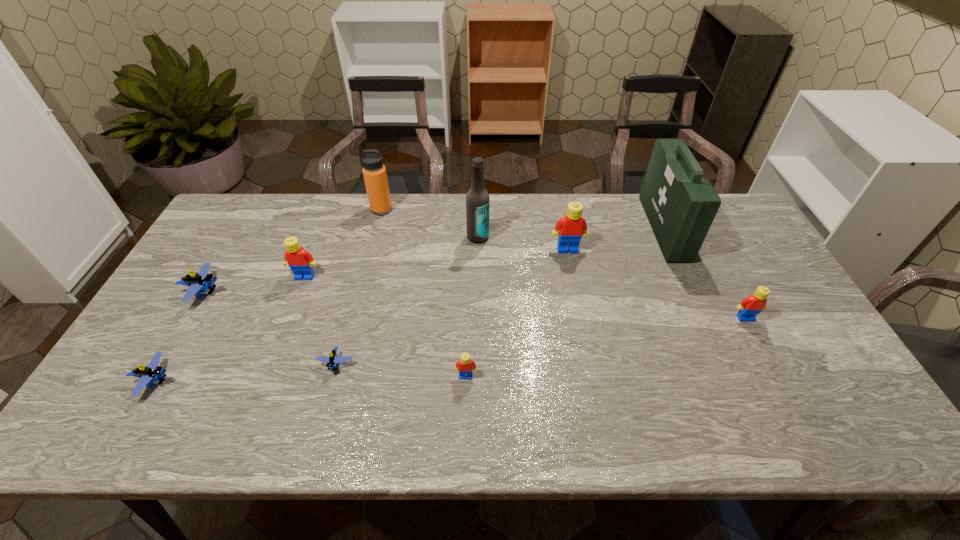
This screenshot has width=960, height=540. I want to click on the biggest blue Lego, so click(x=202, y=281).

The width and height of the screenshot is (960, 540). What are the coordinates of `the smallest red Lego` in the screenshot? It's located at (465, 365).

What are the coordinates of `the third red Lego from right to left` in the screenshot? It's located at (465, 365).

Find the location of a particular element. Image resolution: width=960 pixels, height=540 pixels. the second smallest blue Lego is located at coordinates (152, 372).

Identify the location of the ninth tallest object. Image resolution: width=960 pixels, height=540 pixels. (152, 372).

I want to click on the shortest object, so click(x=332, y=359).

Find the location of `the shortest Lego`. the shortest Lego is located at coordinates (332, 359).

Find the location of `vacant space located 0.300m on the side of the beer bottle with the label`. vacant space located 0.300m on the side of the beer bottle with the label is located at coordinates (477, 318).

Identify the location of free spot located on the front-facing side of the ninth object from left to right. The image size is (960, 540). (580, 228).

The width and height of the screenshot is (960, 540). I want to click on blank space located on the front-facing side of the ninth object from left to right, so click(631, 228).